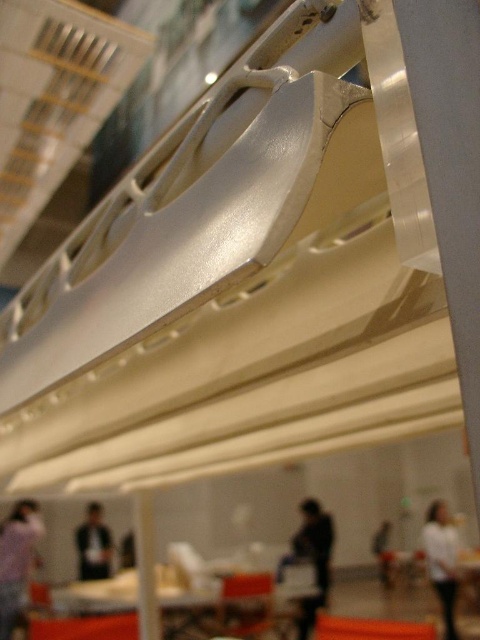
You are an event photographer at the exhibition. You want to capture a photo of the metallic structure while ensuring the white matte shirt at lower right and the white matte person at lower right are visible in the frame. Which object should you adjust your camera angle to prioritize in the foreground to ensure both are in focus?

Since the white matte shirt at lower right is wider than the white matte person at lower right, adjusting the camera angle to prioritize the white matte shirt at lower right in the foreground will ensure both objects remain in focus as they are positioned closely together.

You are an event photographer at the exhibition. You want to capture a clear photo of the metallic structure while ensuring the white matte shirt at lower right and the white matte person at lower right are visible but not blocking the main subject. Which object should you position closer to the edge of the frame to avoid blocking the metallic structure?

The white matte shirt at lower right is taller than the white matte person at lower right. To avoid blocking the metallic structure, position the taller white matte shirt at lower right closer to the edge of the frame since it is larger in height and might obstruct the view more than the shorter white matte person at lower right.

You are at an exhibition and see the dark gray fabric jacket at lower left and the white matte person at lower right. Which object is covering the other one?

The dark gray fabric jacket at lower left is positioned over the white matte person at lower right, so it is covering it.